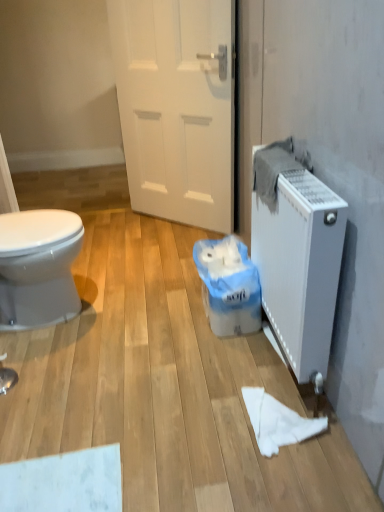
At what (x,y) coordinates should I click in order to perform the action: click on vacant region in front of white matte radiator at right. Please return your answer as a coordinate pair (x, y). The height and width of the screenshot is (512, 384). Looking at the image, I should click on (263, 445).